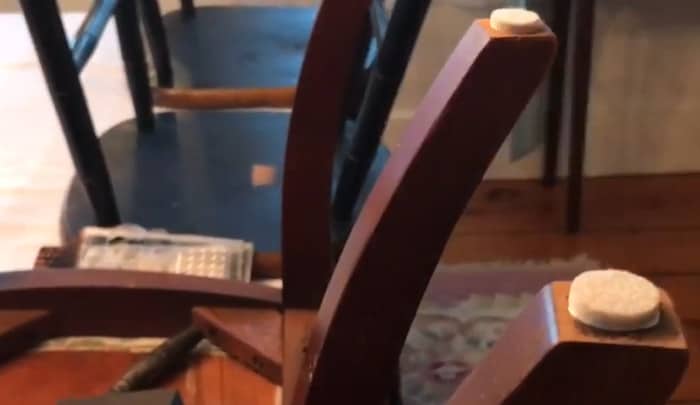
Where is `wall`? wall is located at coordinates (643, 58).